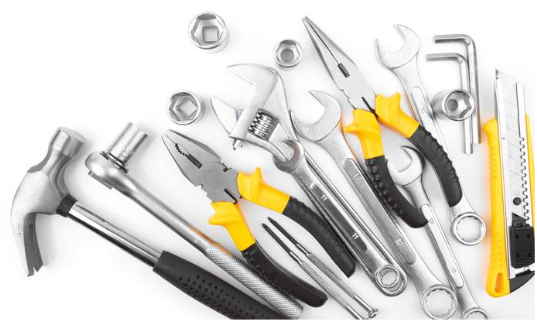
Identify the location of black handles. click(213, 286), click(272, 273), click(322, 243), click(400, 199), click(438, 170).